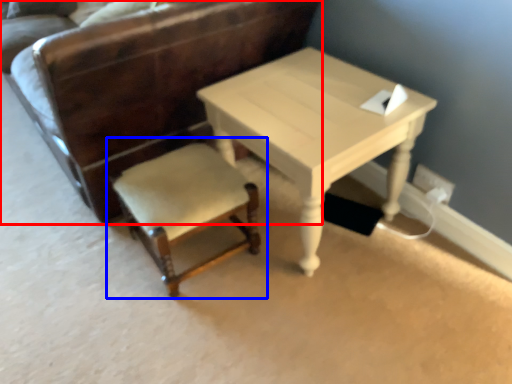
Question: Which object is further to the camera taking this photo, chair (highlighted by a red box) or chair (highlighted by a blue box)?

Choices:
 (A) chair
 (B) chair

Answer: (B)